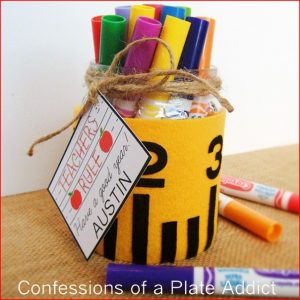
Find the location of a particular element. table cloth is located at coordinates (238, 250).